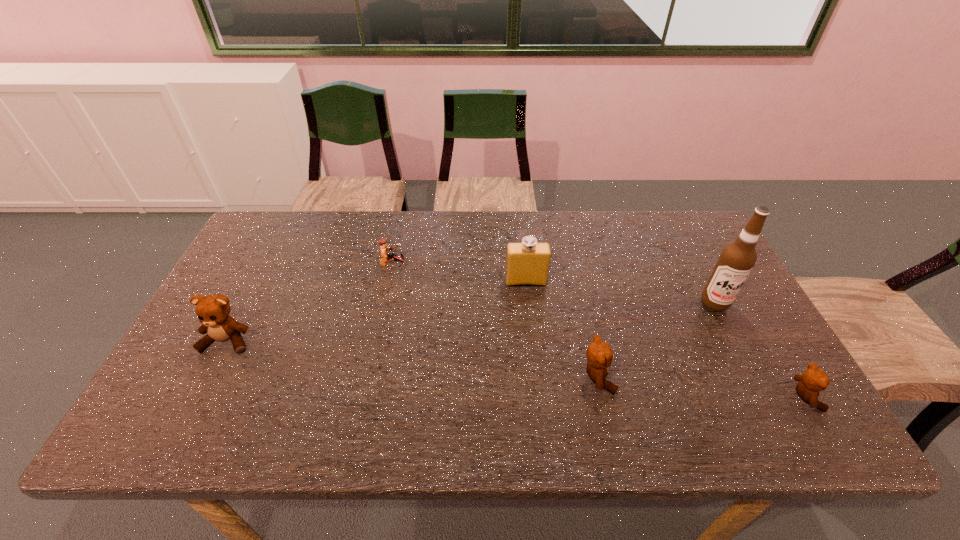
This screenshot has width=960, height=540. In order to click on the fourth shortest object in this screenshot , I will do `click(213, 311)`.

I want to click on the fourth farthest object, so click(x=213, y=311).

This screenshot has height=540, width=960. What are the coordinates of `the third object from right to left` in the screenshot? It's located at (599, 355).

This screenshot has height=540, width=960. Identify the location of the second teddy bear from left to right. (599, 355).

Locate an element on the screen. Image resolution: width=960 pixels, height=540 pixels. the rightmost teddy bear is located at coordinates (813, 380).

Locate an element on the screen. The width and height of the screenshot is (960, 540). the rightmost object is located at coordinates (813, 380).

The image size is (960, 540). Identify the location of the second farthest object. (527, 264).

Find the location of `perfume`. perfume is located at coordinates (527, 264).

Image resolution: width=960 pixels, height=540 pixels. Identify the location of the farthest object. (385, 256).

Identify the location of the second object from left to right. This screenshot has height=540, width=960. (385, 256).